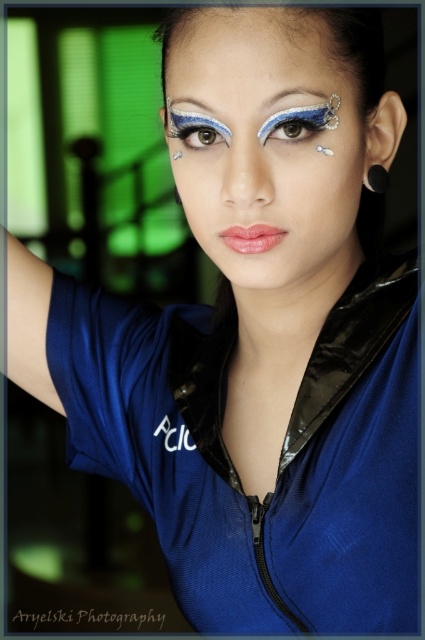
Does shiny blue eye makeup at center have a larger size compared to matte black eyebrow at upper center?

Yes, shiny blue eye makeup at center is bigger than matte black eyebrow at upper center.

Between shiny blue eye makeup at center and matte black eyebrow at upper center, which one is positioned lower?

Positioned lower is shiny blue eye makeup at center.

Does point (206, 38) come behind point (190, 115)?

No, it is in front of (190, 115).

Where is `shiny blue eye makeup at center`? Image resolution: width=425 pixels, height=640 pixels. shiny blue eye makeup at center is located at coordinates (266, 145).

Which is above, blue glitter eye at center or shiny blue eye at center?

shiny blue eye at center is above.

From the picture: Can you confirm if blue glitter eye at center is wider than shiny blue eye at center?

Correct, the width of blue glitter eye at center exceeds that of shiny blue eye at center.

Between point (277, 118) and point (203, 124), which one is positioned in front?

Positioned in front is point (277, 118).

Where is `blue glitter eye at center`? blue glitter eye at center is located at coordinates (289, 124).

Does shiny blue eye makeup at center have a lesser height compared to blue glitter eye at center?

No.

Between shiny blue eye makeup at center and blue glitter eye at center, which one has less height?

blue glitter eye at center is shorter.

Where is `shiny blue eye makeup at center`? shiny blue eye makeup at center is located at coordinates (266, 145).